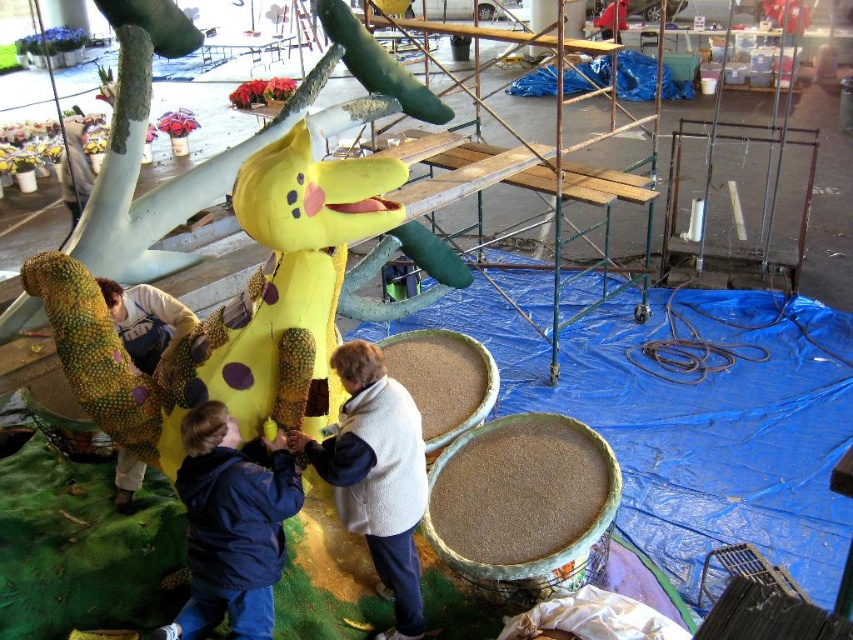
Question: Which point is farther to the camera?

Choices:
 (A) (381, 513)
 (B) (115, 314)

Answer: (B)

Question: Observing the image, what is the correct spatial positioning of blue fleece jacket at lower left in reference to white fleece jacket at center?

Choices:
 (A) left
 (B) right

Answer: (A)

Question: From the image, what is the correct spatial relationship of blue fleece jacket at lower left in relation to white fleece jacket at center?

Choices:
 (A) left
 (B) right

Answer: (A)

Question: Is blue fleece jacket at lower left to the right of matte yellow costume at center from the viewer's perspective?

Choices:
 (A) yes
 (B) no

Answer: (A)

Question: Which of these objects is positioned farthest from the white fleece jacket at center?

Choices:
 (A) matte yellow costume at center
 (B) blue fleece jacket at lower left

Answer: (A)

Question: Which object appears farthest from the camera in this image?

Choices:
 (A) matte yellow costume at center
 (B) blue fleece jacket at lower left

Answer: (A)